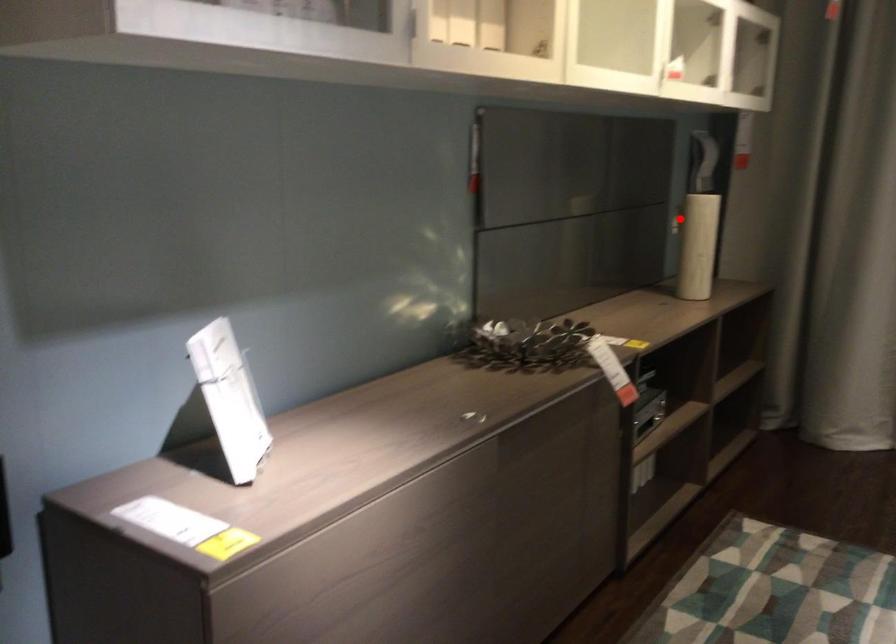
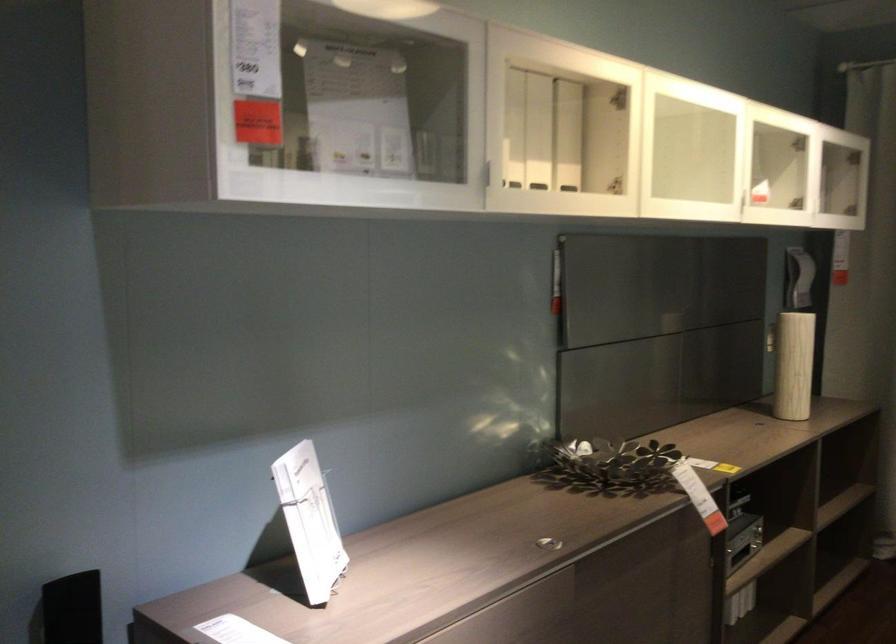
Question: I am providing you with two images of the same scene from different viewpoints. A red point is marked on the first image. Can you still see the location of the red point in image 2?

Choices:
 (A) Yes
 (B) No

Answer: (A)